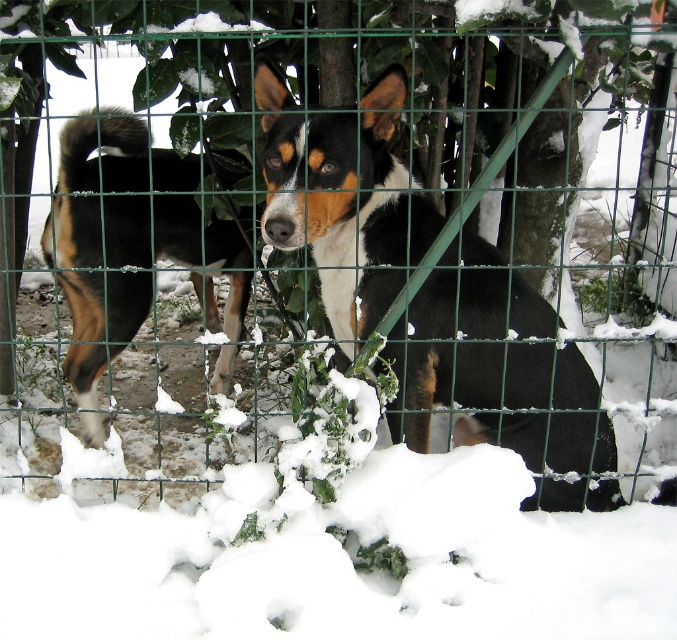
Question: Which point appears farthest from the camera in this image?

Choices:
 (A) (x=403, y=97)
 (B) (x=169, y=227)

Answer: (B)

Question: Does black and tan fur dog at center appear over brown and white fur at center?

Choices:
 (A) yes
 (B) no

Answer: (B)

Question: Can you confirm if black and tan fur dog at center is wider than brown and white fur at center?

Choices:
 (A) yes
 (B) no

Answer: (A)

Question: Does black and tan fur dog at center appear on the left side of brown and white fur at center?

Choices:
 (A) yes
 (B) no

Answer: (B)